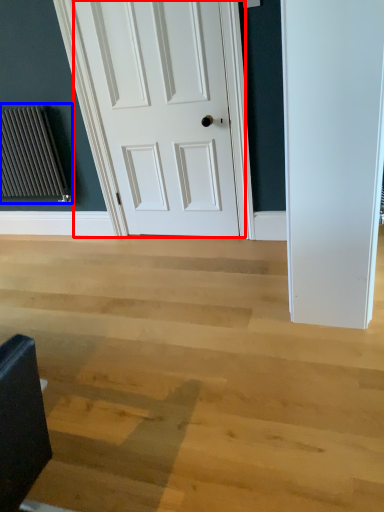
Question: Which object appears closest to the camera in this image, door (highlighted by a red box) or radiator (highlighted by a blue box)?

Choices:
 (A) door
 (B) radiator

Answer: (A)